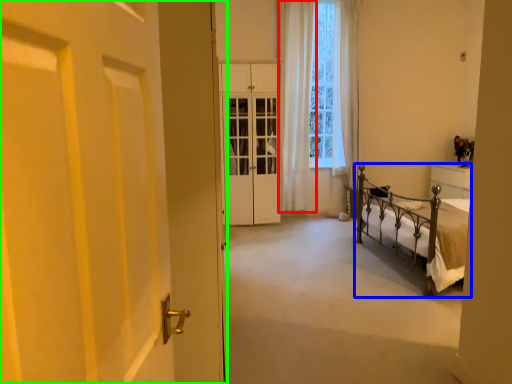
Question: Estimate the real-world distances between objects in this image. Which object is farther from curtain (highlighted by a red box), bed (highlighted by a blue box) or door (highlighted by a green box)?

Choices:
 (A) bed
 (B) door

Answer: (B)